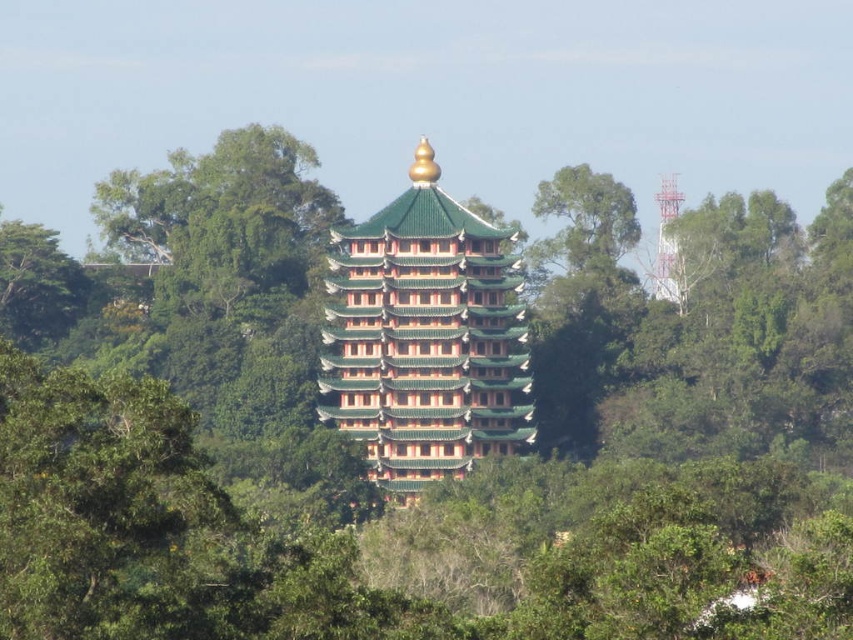
Question: Is green glazed tiles at center positioned in front of green leafy tree at upper center?

Choices:
 (A) yes
 (B) no

Answer: (A)

Question: Based on their relative distances, which object is nearer to the green leafy tree at upper center?

Choices:
 (A) white metallic tower at upper center
 (B) green glazed tiles at center

Answer: (A)

Question: Can you confirm if green glazed tiles at center is positioned above white metallic tower at upper center?

Choices:
 (A) no
 (B) yes

Answer: (A)

Question: Is green glazed tiles at center above green leafy tree at upper center?

Choices:
 (A) no
 (B) yes

Answer: (A)

Question: Which object is the farthest from the green leafy tree at upper center?

Choices:
 (A) white metallic tower at upper center
 (B) green glazed tiles at center

Answer: (B)

Question: Which of the following is the farthest from the observer?

Choices:
 (A) green leafy tree at upper center
 (B) white metallic tower at upper center

Answer: (A)